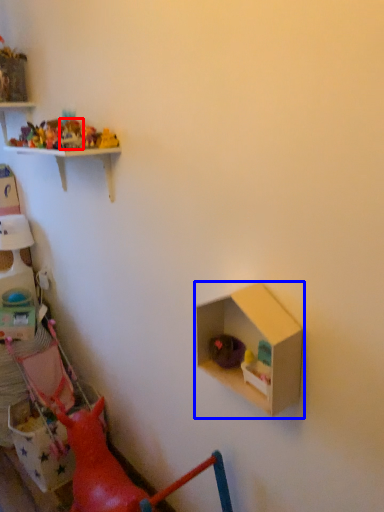
Question: Which object appears farthest to the camera in this image, toy (highlighted by a red box) or shelf (highlighted by a blue box)?

Choices:
 (A) toy
 (B) shelf

Answer: (A)